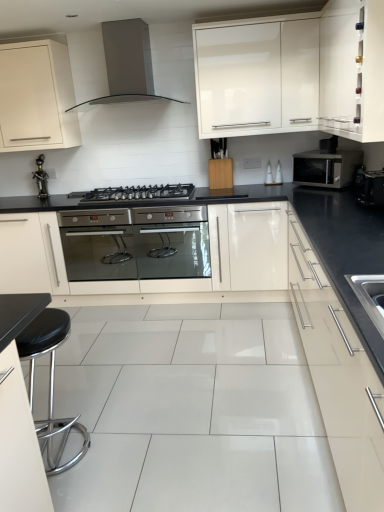
Question: From a real-world perspective, does satin silver drawer at right, the third cabinetry positioned from the left, sit lower than satin metallic range hood at upper center?

Choices:
 (A) yes
 (B) no

Answer: (A)

Question: Is satin silver drawer at right, the second cabinetry viewed from the right, facing towards satin metallic range hood at upper center?

Choices:
 (A) yes
 (B) no

Answer: (B)

Question: Is satin silver drawer at right, the second cabinetry viewed from the right, taller than satin metallic range hood at upper center?

Choices:
 (A) no
 (B) yes

Answer: (B)

Question: Is satin silver drawer at right, the second cabinetry viewed from the right, oriented away from satin metallic range hood at upper center?

Choices:
 (A) no
 (B) yes

Answer: (A)

Question: Considering the relative positions of satin silver drawer at right, the third cabinetry positioned from the left, and satin metallic range hood at upper center in the image provided, is satin silver drawer at right, the third cabinetry positioned from the left, in front of satin metallic range hood at upper center?

Choices:
 (A) no
 (B) yes

Answer: (B)

Question: From the image's perspective, is satin silver drawer at right, the second cabinetry viewed from the right, beneath satin metallic range hood at upper center?

Choices:
 (A) yes
 (B) no

Answer: (A)

Question: From the image's perspective, is black plastic toaster at right over white glossy cabinet at upper left, the 4th cabinetry when ordered from right to left?

Choices:
 (A) no
 (B) yes

Answer: (A)

Question: Is black plastic toaster at right thinner than white glossy cabinet at upper left, placed as the 1th cabinetry when sorted from left to right?

Choices:
 (A) yes
 (B) no

Answer: (A)

Question: Would you say black plastic toaster at right is a long distance from white glossy cabinet at upper left, placed as the 1th cabinetry when sorted from left to right?

Choices:
 (A) yes
 (B) no

Answer: (A)

Question: Is white glossy cabinet at upper left, placed as the 1th cabinetry when sorted from left to right, at the back of black plastic toaster at right?

Choices:
 (A) yes
 (B) no

Answer: (B)

Question: From the image's perspective, is black plastic toaster at right beneath white glossy cabinet at upper left, placed as the 1th cabinetry when sorted from left to right?

Choices:
 (A) no
 (B) yes

Answer: (B)

Question: Considering the relative sizes of black plastic toaster at right and white glossy cabinet at upper left, placed as the 1th cabinetry when sorted from left to right, in the image provided, is black plastic toaster at right taller than white glossy cabinet at upper left, placed as the 1th cabinetry when sorted from left to right,?

Choices:
 (A) yes
 (B) no

Answer: (B)

Question: Does white glossy cabinet at upper right, which is counted as the 4th cabinetry, starting from the left, have a smaller size compared to satin silver microwave at right?

Choices:
 (A) no
 (B) yes

Answer: (A)